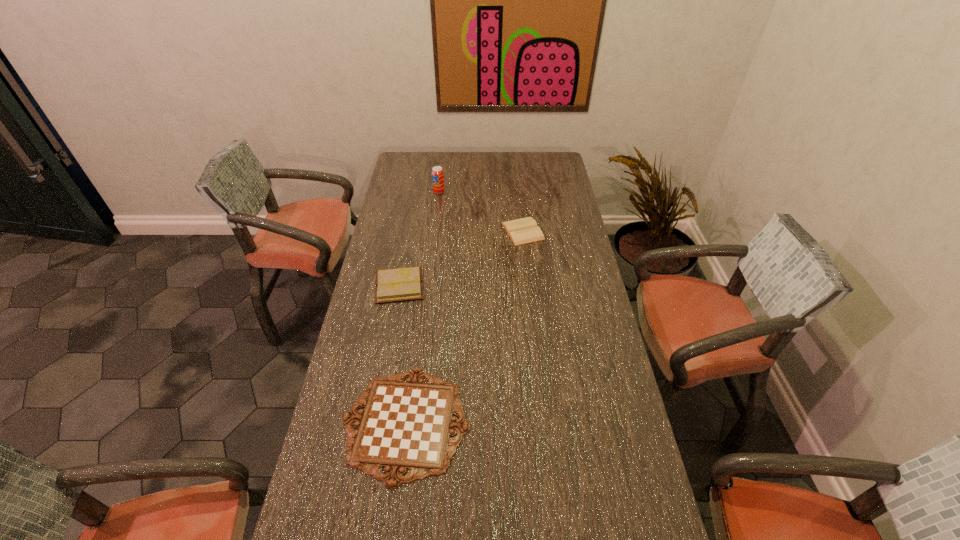
Locate an element on the screen. vacant space that is in between the farthest object and the second farthest object is located at coordinates (481, 211).

In order to click on free space between the left diary and the right diary in this screenshot , I will do `click(461, 258)`.

Find the location of `vacant area that lies between the third nearest object and the shortest object`. vacant area that lies between the third nearest object and the shortest object is located at coordinates (465, 327).

The width and height of the screenshot is (960, 540). Identify the location of vacant region between the left diary and the nearest object. (402, 354).

Identify the location of free space that is in between the second nearest object and the soda can. (420, 239).

What are the coordinates of `free space between the right diary and the chessboard` in the screenshot? It's located at (465, 327).

Find the location of a particular element. vacant point located between the third nearest object and the farthest object is located at coordinates pos(481,211).

The image size is (960, 540). I want to click on vacant region between the nearest object and the nearer diary, so click(402, 354).

Image resolution: width=960 pixels, height=540 pixels. What are the coordinates of `vacant point located between the soda can and the nearest object` in the screenshot? It's located at (422, 307).

At what (x,y) coordinates should I click in order to perform the action: click on object that stands as the second closest to the shortest object. Please return your answer as a coordinate pair (x, y). Looking at the image, I should click on (521, 231).